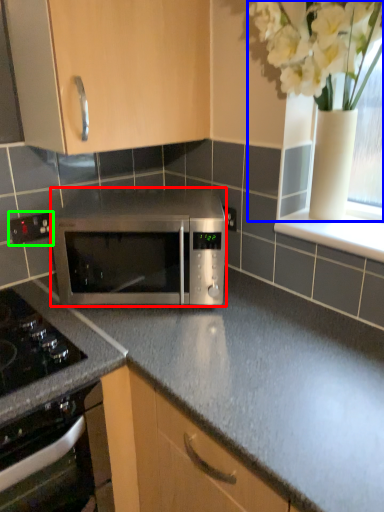
Question: Based on their relative distances, which object is farther from microwave oven (highlighted by a red box)? Choose from floral arrangement (highlighted by a blue box) and electric outlet (highlighted by a green box).

Choices:
 (A) floral arrangement
 (B) electric outlet

Answer: (A)